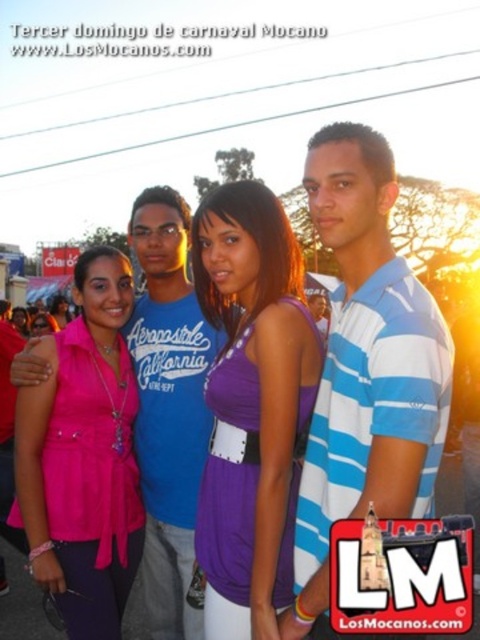
Who is more distant from viewer, (223, 188) or (24, 310)?

Positioned behind is point (24, 310).

Does point (288, 548) lie behind point (26, 330)?

No, it is not.

This screenshot has height=640, width=480. I want to click on purple fabric dress at center, so click(252, 404).

Can you confirm if matte pink blouse at center is wider than pink fabric top at center?

No.

Find the location of a particular element. matte pink blouse at center is located at coordinates (84, 456).

Which is behind, point (115, 259) or point (16, 324)?

The point (16, 324) is more distant.

At what (x,y) coordinates should I click in order to perform the action: click on matte pink blouse at center. Please return your answer as a coordinate pair (x, y). This screenshot has height=640, width=480. Looking at the image, I should click on (84, 456).

Between purple fabric dress at center and matte pink blouse at center, which one appears on the right side from the viewer's perspective?

From the viewer's perspective, purple fabric dress at center appears more on the right side.

Describe the element at coordinates (252, 404) in the screenshot. This screenshot has height=640, width=480. I see `purple fabric dress at center` at that location.

Where is `purple fabric dress at center`? The image size is (480, 640). purple fabric dress at center is located at coordinates (252, 404).